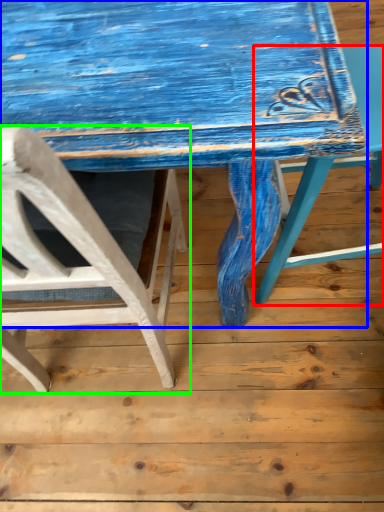
Question: Which object is positioned closest to chair (highlighted by a red box)? Select from table (highlighted by a blue box) and chair (highlighted by a green box).

Choices:
 (A) table
 (B) chair

Answer: (A)